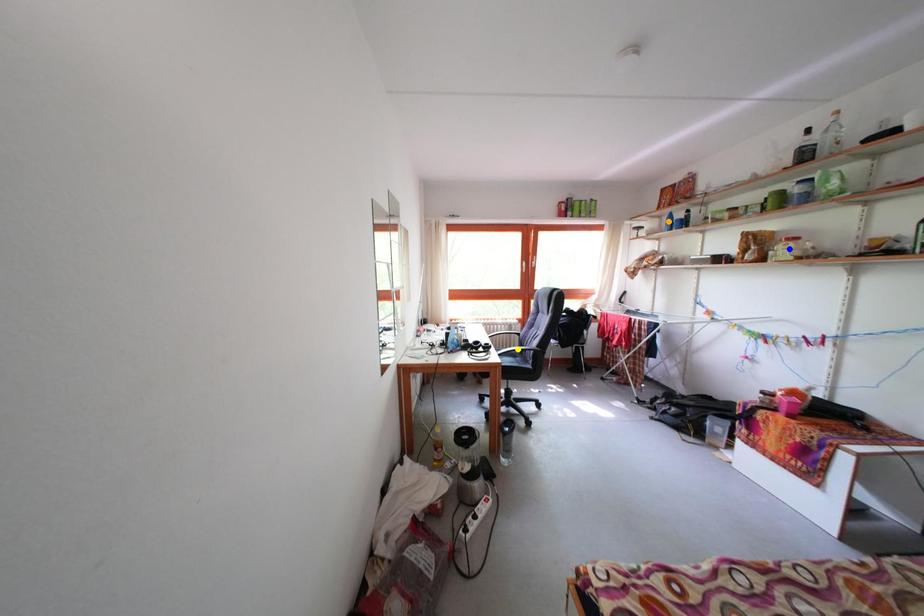
Order these from nearest to farthest:
orange point, blue point, yellow point

1. orange point
2. yellow point
3. blue point